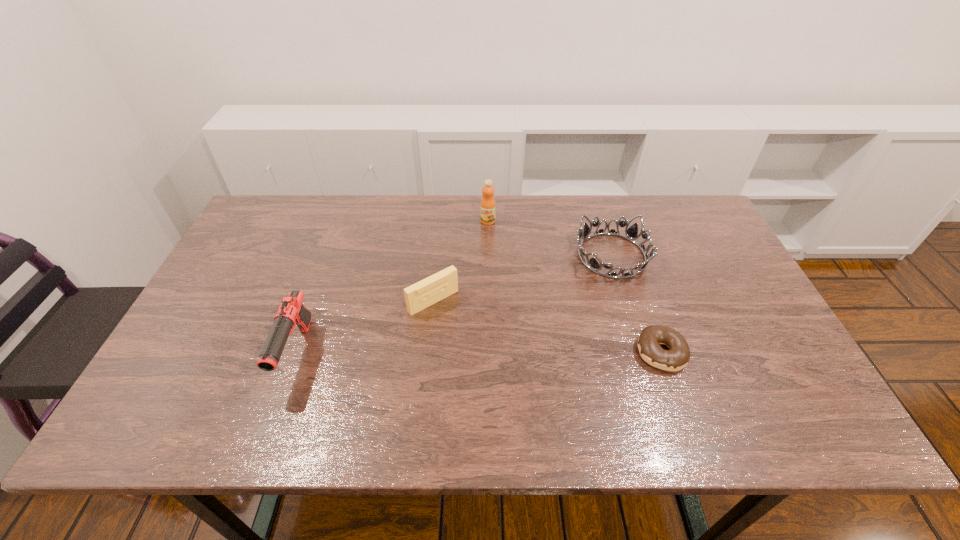
At what (x,y) coordinates should I click in order to perform the action: click on doughnut located in the near edge section of the desktop. Please return your answer as a coordinate pair (x, y). Image resolution: width=960 pixels, height=540 pixels. Looking at the image, I should click on (677, 357).

In the image, there is a desktop. In order to click on vacant space at the far edge in this screenshot , I will do `click(579, 221)`.

Find the location of a particular element. The image size is (960, 540). free location at the near edge is located at coordinates tap(390, 388).

The image size is (960, 540). I want to click on vacant space at the left edge, so point(243,289).

Find the location of a particular element. This screenshot has width=960, height=540. free spot at the right edge of the desktop is located at coordinates (753, 346).

Locate an element on the screen. This screenshot has width=960, height=540. vacant region at the far left corner is located at coordinates (279, 238).

Where is `free space at the near left corner`? The width and height of the screenshot is (960, 540). free space at the near left corner is located at coordinates (189, 394).

At what (x,y) coordinates should I click in order to perform the action: click on vacant point at the near right corner. Please return your answer as a coordinate pair (x, y). The width and height of the screenshot is (960, 540). Looking at the image, I should click on (796, 381).

Find the location of a particular element. blank region between the gun and the doughnut is located at coordinates (479, 353).

This screenshot has height=540, width=960. Identify the location of vacant region between the farthest object and the videotape. (461, 261).